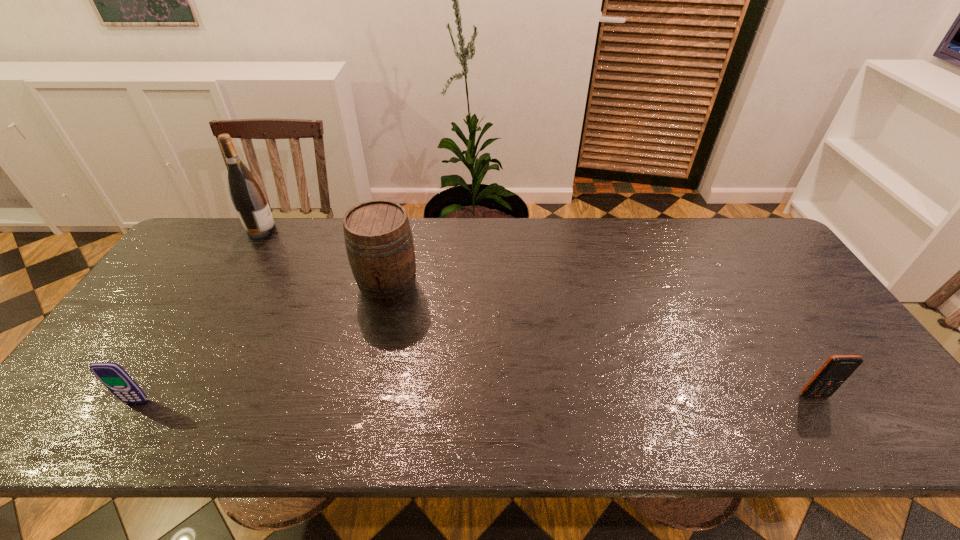
Locate an element on the screen. The height and width of the screenshot is (540, 960). free space between the left cellular telephone and the wine bottle is located at coordinates (199, 316).

Where is `vacant region between the nearer cellular telephone and the rightmost object`? The image size is (960, 540). vacant region between the nearer cellular telephone and the rightmost object is located at coordinates (475, 399).

Identify the location of object that is the nearest to the third farthest object. This screenshot has width=960, height=540. (379, 242).

Locate an element on the screen. This screenshot has height=540, width=960. the closest object relative to the left cellular telephone is located at coordinates (379, 242).

Where is `free point that satisfies the following two spatial constraints: 1. on the label of the farthest object; 2. on the front-facing side of the nearest object`? This screenshot has height=540, width=960. free point that satisfies the following two spatial constraints: 1. on the label of the farthest object; 2. on the front-facing side of the nearest object is located at coordinates (159, 402).

Image resolution: width=960 pixels, height=540 pixels. Identify the location of free spot that satisfies the following two spatial constraints: 1. on the label of the tallest object; 2. on the front-facing side of the nearer cellular telephone. (159, 402).

Where is `free space that satisfies the following two spatial constraints: 1. on the label of the wine bottle; 2. on the front-facing side of the nearest object`? The image size is (960, 540). free space that satisfies the following two spatial constraints: 1. on the label of the wine bottle; 2. on the front-facing side of the nearest object is located at coordinates (159, 402).